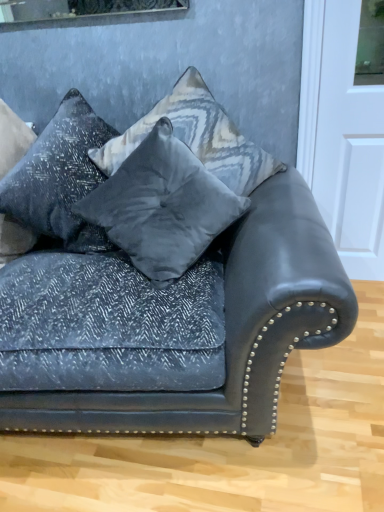
Question: Does velvet gray pillow at center, the second pillow from the left, have a larger size compared to velvet gray pillow at center, the 1th pillow from the right?

Choices:
 (A) yes
 (B) no

Answer: (B)

Question: Is velvet gray pillow at center, placed as the 2th pillow when sorted from right to left, in front of velvet gray pillow at center, the 1th pillow from the right?

Choices:
 (A) yes
 (B) no

Answer: (A)

Question: Is velvet gray pillow at center, the second pillow from the left, further to the viewer compared to velvet gray pillow at center, the 3th pillow in the left-to-right sequence?

Choices:
 (A) yes
 (B) no

Answer: (B)

Question: Is velvet gray pillow at center, the second pillow from the left, far away from velvet gray pillow at center, the 3th pillow in the left-to-right sequence?

Choices:
 (A) no
 (B) yes

Answer: (A)

Question: Can you confirm if velvet gray pillow at center, the second pillow from the left, is taller than velvet gray pillow at center, the 1th pillow from the right?

Choices:
 (A) yes
 (B) no

Answer: (B)

Question: Considering the relative sizes of velvet gray pillow at center, the second pillow from the left, and velvet gray pillow at center, the 1th pillow from the right, in the image provided, is velvet gray pillow at center, the second pillow from the left, smaller than velvet gray pillow at center, the 1th pillow from the right,?

Choices:
 (A) yes
 (B) no

Answer: (A)

Question: Is velvet dark blue couch at center not within velvet gray pillow at center, the 1th pillow from the right?

Choices:
 (A) yes
 (B) no

Answer: (A)

Question: Is velvet dark blue couch at center not near velvet gray pillow at center, the 1th pillow from the right?

Choices:
 (A) no
 (B) yes

Answer: (A)

Question: From a real-world perspective, does velvet dark blue couch at center sit lower than velvet gray pillow at center, the 3th pillow in the left-to-right sequence?

Choices:
 (A) yes
 (B) no

Answer: (A)

Question: Does velvet dark blue couch at center come behind velvet gray pillow at center, the 1th pillow from the right?

Choices:
 (A) yes
 (B) no

Answer: (B)

Question: From the image's perspective, is velvet dark blue couch at center under velvet gray pillow at center, the 1th pillow from the right?

Choices:
 (A) no
 (B) yes

Answer: (B)

Question: Is the position of velvet dark blue couch at center less distant than that of velvet gray pillow at center, the 3th pillow in the left-to-right sequence?

Choices:
 (A) no
 (B) yes

Answer: (B)

Question: Does velvet gray pillow at center, placed as the 2th pillow when sorted from right to left, contain textured gray pillow at upper left, which is the first pillow in left-to-right order?

Choices:
 (A) yes
 (B) no

Answer: (B)